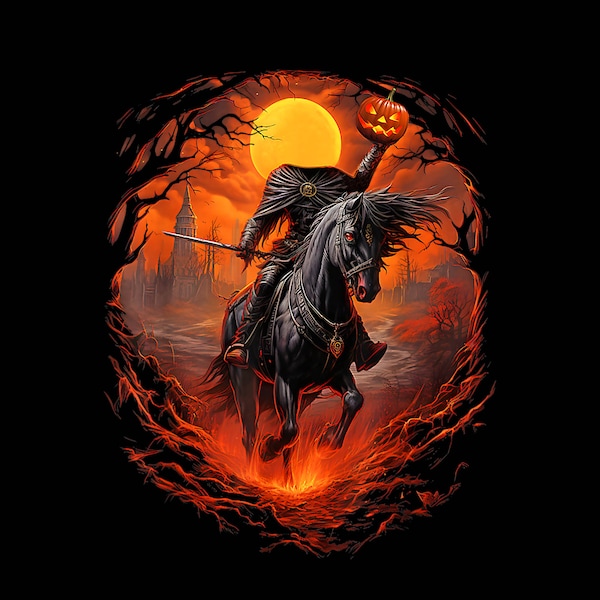
At what (x,y) coordinates should I click in order to perform the action: click on picture. Please return your answer as a coordinate pair (x, y). The width and height of the screenshot is (600, 600). Looking at the image, I should click on (388, 322).